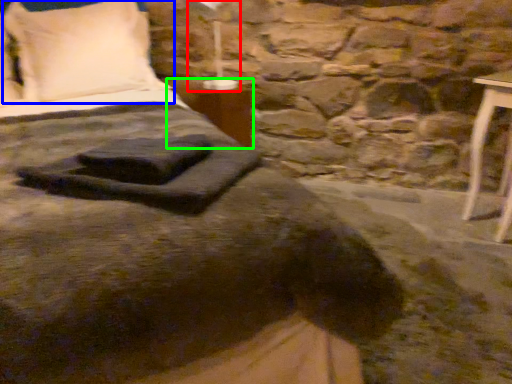
Question: Which object is positioned closest to bedside lamp (highlighted by a red box)? Select from pillow (highlighted by a blue box) and table (highlighted by a green box).

Choices:
 (A) pillow
 (B) table

Answer: (B)